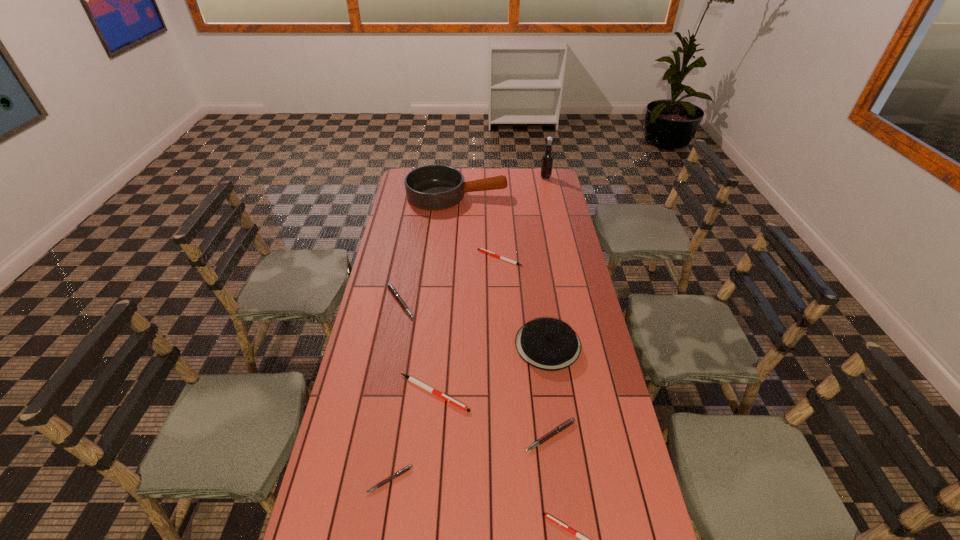
Locate an element on the screen. The width and height of the screenshot is (960, 540). the sixth closest object to the rightmost pink pen is located at coordinates (481, 249).

Locate which pen is the third closest to the smallest pink pen. Please provide its 2D coordinates. Your answer should be formatted as a tuple, i.e. [(x, y)], where the tuple contains the x and y coordinates of a point satisfying the conditions above.

[(584, 539)]

This screenshot has width=960, height=540. I want to click on pen that stands as the fourth closest to the second smallest pink pen, so click(391, 288).

At what (x,y) coordinates should I click in order to perform the action: click on pink pen that is the third closest to the leftmost white pen. Please return your answer as a coordinate pair (x, y). Looking at the image, I should click on (391, 288).

Choose which pink pen is the second nearest neighbor to the smallest pink pen. Please provide its 2D coordinates. Your answer should be formatted as a tuple, i.e. [(x, y)], where the tuple contains the x and y coordinates of a point satisfying the conditions above.

[(391, 288)]

Identify the location of white pen that is the closest to the tallest object. The height and width of the screenshot is (540, 960). pos(481,249).

Select which white pen is the closest to the third farthest object. Please provide its 2D coordinates. Your answer should be formatted as a tuple, i.e. [(x, y)], where the tuple contains the x and y coordinates of a point satisfying the conditions above.

[(410, 378)]

At what (x,y) coordinates should I click in order to perform the action: click on free spot that satisfies the following two spatial constraints: 1. on the back side of the pancake; 2. at the nib of the farthest pink pen. Please return your answer as a coordinate pair (x, y). The height and width of the screenshot is (540, 960). Looking at the image, I should click on (541, 302).

This screenshot has height=540, width=960. In order to click on free location that satisfies the following two spatial constraints: 1. on the back side of the pancake; 2. on the handle side of the eighth shortest object in this screenshot , I will do `click(526, 195)`.

Locate an element on the screen. Image resolution: width=960 pixels, height=540 pixels. free location that satisfies the following two spatial constraints: 1. on the clicker of the seventh nearest object; 2. on the left side of the pancake is located at coordinates (505, 345).